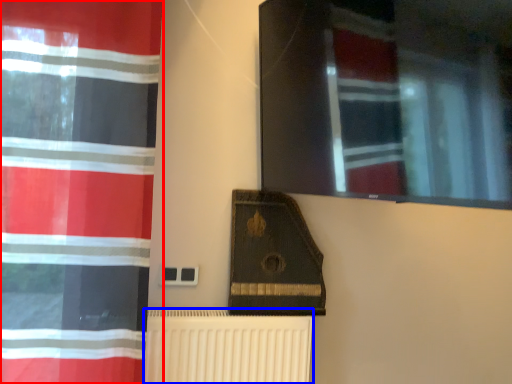
Question: Which of the following is the farthest to the observer, curtain (highlighted by a red box) or radiator (highlighted by a blue box)?

Choices:
 (A) curtain
 (B) radiator

Answer: (B)